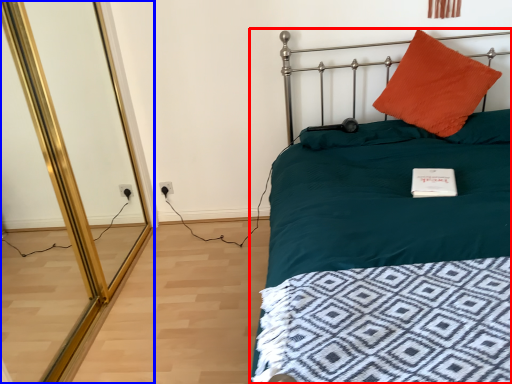
Question: Which of the following is the closest to the observer, bed (highlighted by a red box) or screen door (highlighted by a blue box)?

Choices:
 (A) bed
 (B) screen door

Answer: (A)